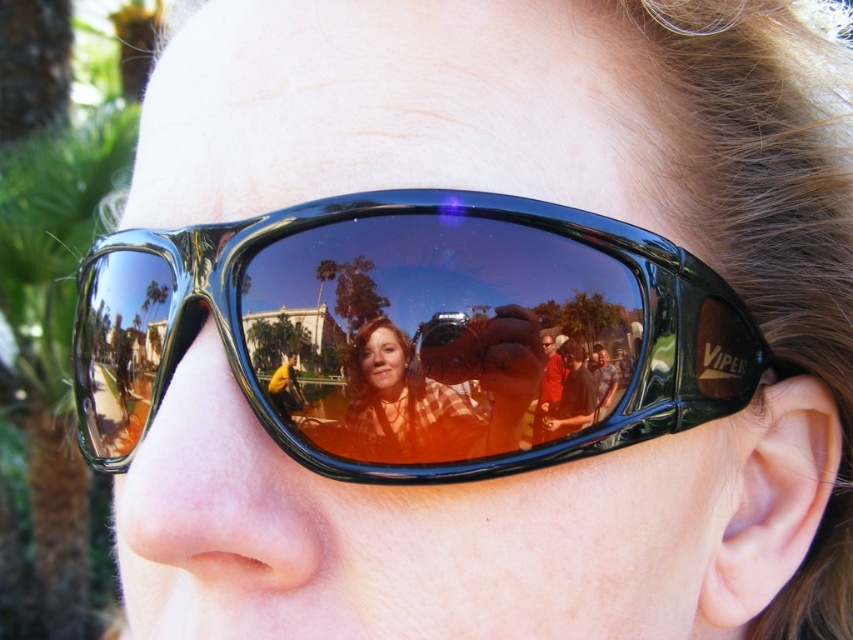
Question: Can you confirm if shiny black goggles at center is thinner than matte orange sunglasses at center?

Choices:
 (A) no
 (B) yes

Answer: (A)

Question: Which point is farther to the camera?

Choices:
 (A) shiny black goggles at center
 (B) matte orange sunglasses at center

Answer: (B)

Question: Which point appears farthest from the camera in this image?

Choices:
 (A) (428, 416)
 (B) (506, 316)

Answer: (A)

Question: Does shiny black goggles at center appear over matte orange sunglasses at center?

Choices:
 (A) yes
 (B) no

Answer: (A)

Question: Is shiny black goggles at center to the right of matte orange sunglasses at center from the viewer's perspective?

Choices:
 (A) no
 (B) yes

Answer: (A)